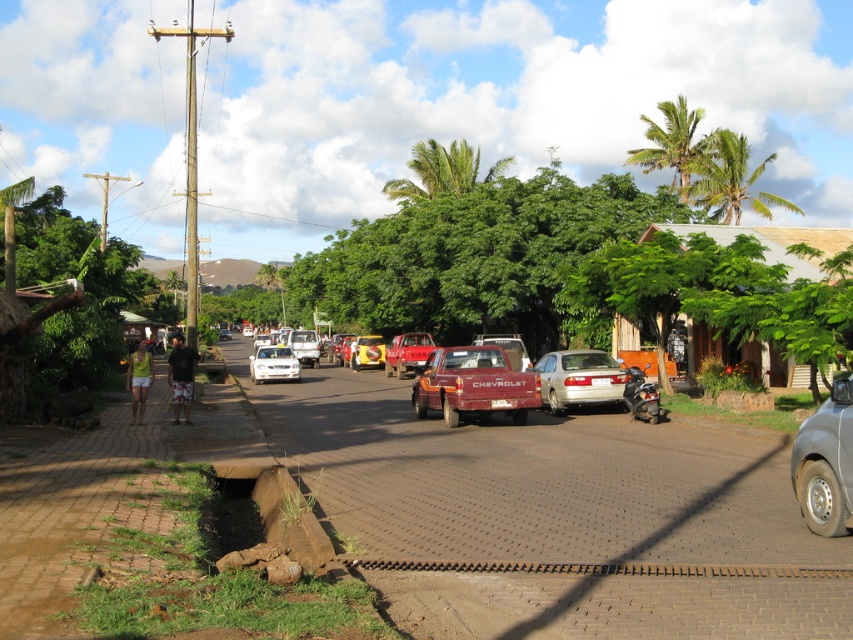
Question: Which object is the farthest from the yellow matte car at center?

Choices:
 (A) white glossy car at center
 (B) white glossy sedan at center
 (C) silver metallic car at right
 (D) rustic metal pickup truck at center

Answer: (C)

Question: Can you confirm if shiny black motorcycle at center-right is thinner than yellow matte car at center?

Choices:
 (A) yes
 (B) no

Answer: (A)

Question: Observing the image, what is the correct spatial positioning of yellow matte car at center in reference to matte red truck at center?

Choices:
 (A) below
 (B) above

Answer: (A)

Question: Does red matte pickup truck at center appear under yellow matte car at center?

Choices:
 (A) no
 (B) yes

Answer: (A)

Question: Which of the following is the farthest from the observer?

Choices:
 (A) yellow matte car at center
 (B) rustic metal pickup truck at center

Answer: (A)

Question: Which is farther from the red matte pickup truck at center?

Choices:
 (A) yellow matte car at center
 (B) white glossy sedan at center

Answer: (B)